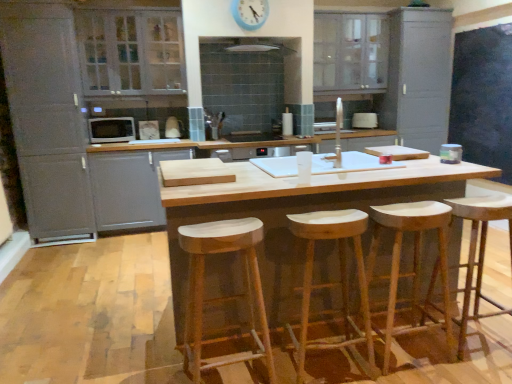
The image size is (512, 384). What are the coordinates of `vacant space that is in between natural wood stool at center, the 2th stool from the right, and natural wood stool at center, which is the third stool from left to right` in the screenshot? It's located at (387, 369).